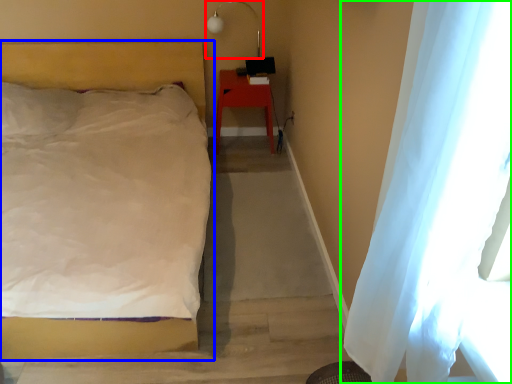
Question: Considering the real-world distances, which object is closest to lamp (highlighted by a red box)? bed (highlighted by a blue box) or curtain (highlighted by a green box).

Choices:
 (A) bed
 (B) curtain

Answer: (A)